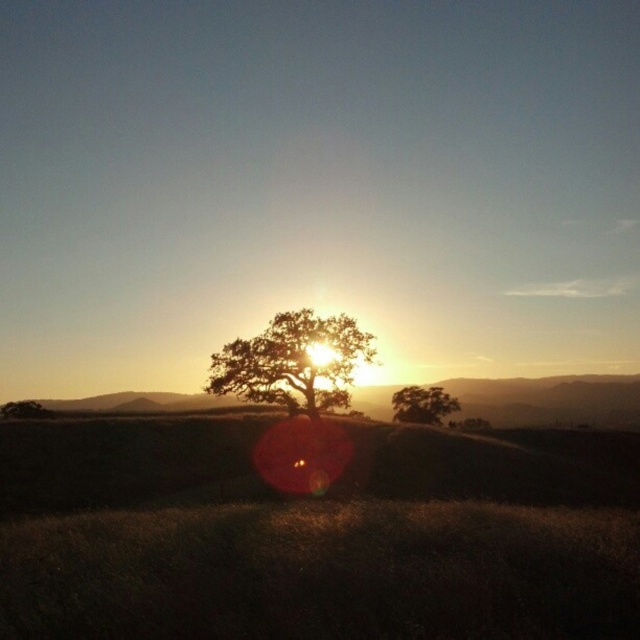
Question: Does silvery textured tree at center have a smaller size compared to brown matte tree at lower left?

Choices:
 (A) no
 (B) yes

Answer: (B)

Question: Based on their relative distances, which object is nearer to the brown matte tree at lower left?

Choices:
 (A) green matte tree at center
 (B) silvery textured tree at center

Answer: (B)

Question: Can you confirm if green matte tree at center is positioned above brown matte tree at lower left?

Choices:
 (A) no
 (B) yes

Answer: (B)

Question: Which of the following is the closest to the observer?

Choices:
 (A) brown matte tree at lower left
 (B) green matte tree at center

Answer: (A)

Question: Which of the following is the farthest from the observer?

Choices:
 (A) brown matte tree at lower left
 (B) green matte tree at center

Answer: (B)

Question: Considering the relative positions of silvery textured tree at center and green matte tree at center in the image provided, where is silvery textured tree at center located with respect to green matte tree at center?

Choices:
 (A) left
 (B) right

Answer: (A)